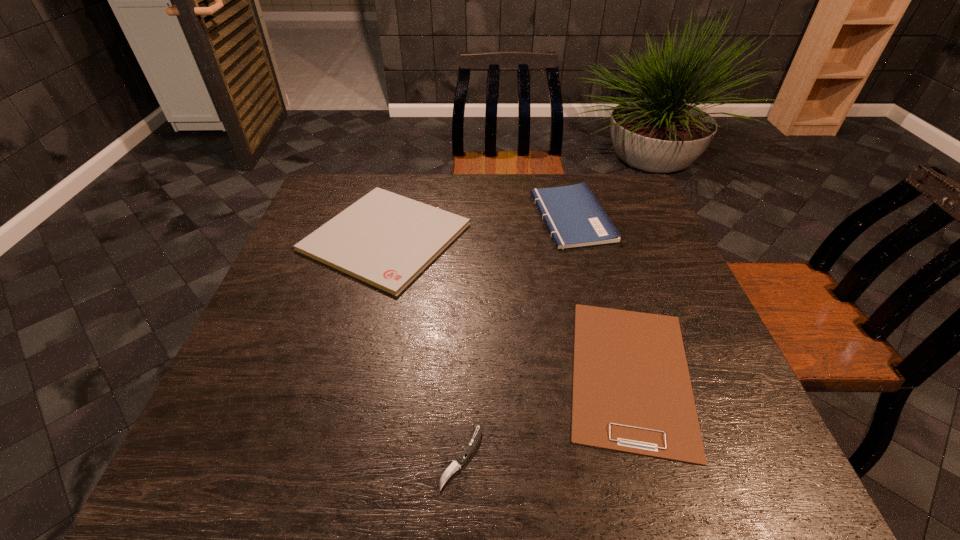
The height and width of the screenshot is (540, 960). In the image, there is a desktop. Identify the location of free space at the far edge. (528, 200).

Find the location of a particular element. blank space at the near edge of the desktop is located at coordinates (627, 483).

The image size is (960, 540). I want to click on free point at the left edge, so click(272, 388).

The image size is (960, 540). What are the coordinates of `free space at the right edge of the desktop` in the screenshot? It's located at (632, 225).

The height and width of the screenshot is (540, 960). I want to click on vacant space at the far left corner of the desktop, so click(x=340, y=178).

Where is `vacant region between the pocketknife and the paperback book`? The width and height of the screenshot is (960, 540). vacant region between the pocketknife and the paperback book is located at coordinates (516, 336).

Image resolution: width=960 pixels, height=540 pixels. Find the location of `blank region between the right clipboard and the tallest object`. blank region between the right clipboard and the tallest object is located at coordinates (601, 295).

At what (x,y) coordinates should I click in order to perform the action: click on vacant region between the tallest object and the pocketknife. Please return your answer as a coordinate pair (x, y). This screenshot has height=540, width=960. Looking at the image, I should click on (516, 336).

Where is `free area in between the tallest object and the pocketknife`? The image size is (960, 540). free area in between the tallest object and the pocketknife is located at coordinates (516, 336).

Where is `empty space that is in between the pocketknife and the tallest object`? Image resolution: width=960 pixels, height=540 pixels. empty space that is in between the pocketknife and the tallest object is located at coordinates (516, 336).